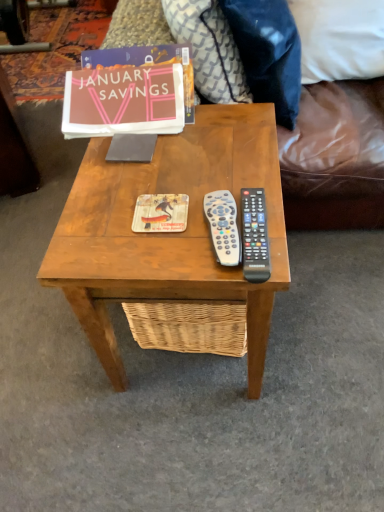
Where is `free point behind black plastic remote at center right, placed as the second remote control when sorted from left to right`? free point behind black plastic remote at center right, placed as the second remote control when sorted from left to right is located at coordinates (227, 170).